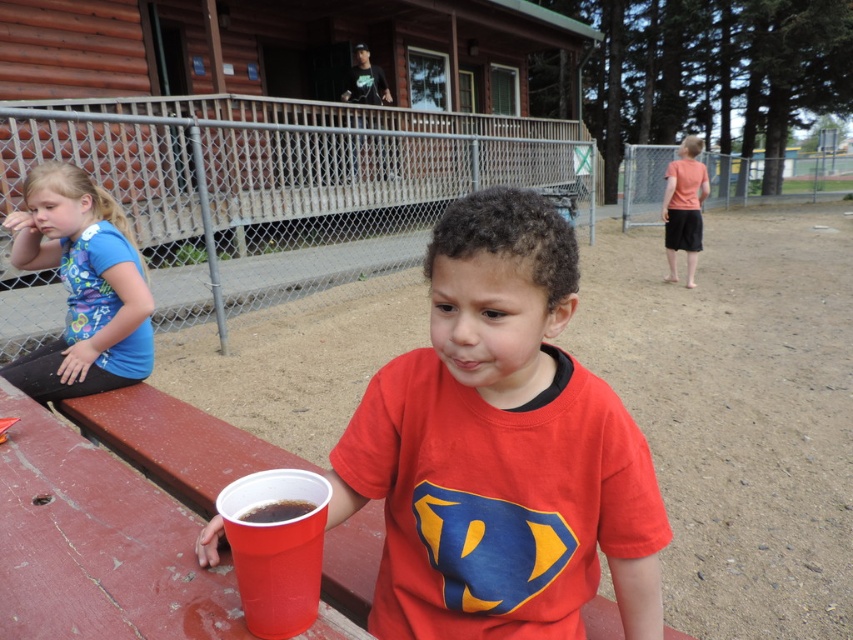
Question: Among these objects, which one is nearest to the camera?

Choices:
 (A) blue cotton shirt at left
 (B) matte plastic cup at center

Answer: (B)

Question: Which point is farther from the camera taking this photo?

Choices:
 (A) (254, 600)
 (B) (251, 515)

Answer: (B)

Question: Which point appears closest to the camera in this image?

Choices:
 (A) (236, 497)
 (B) (73, 266)
 (C) (401, 387)
 (D) (303, 500)

Answer: (A)

Question: Is matte plastic cup at center smaller than matte pink shirt at right?

Choices:
 (A) no
 (B) yes

Answer: (B)

Question: Is blue cotton shirt at left above shiny plastic cup at lower left?

Choices:
 (A) no
 (B) yes

Answer: (B)

Question: Is matte plastic cup at center positioned in front of shiny plastic cup at lower left?

Choices:
 (A) yes
 (B) no

Answer: (B)